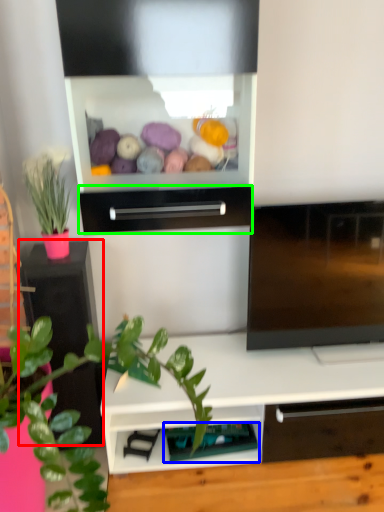
Question: Estimate the real-world distances between objects in this image. Which object is closer to table (highlighted by a red box), shelf (highlighted by a blue box) or drawer (highlighted by a green box)?

Choices:
 (A) shelf
 (B) drawer

Answer: (B)